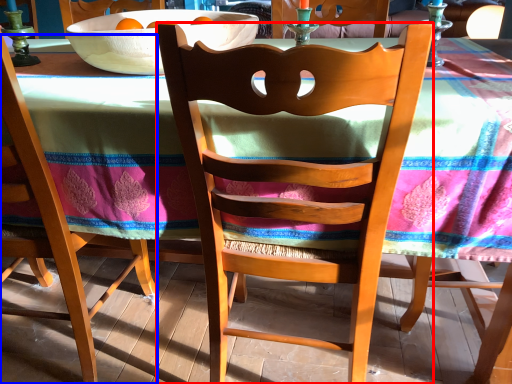
Question: Which object is closer to the camera taking this photo, chair (highlighted by a red box) or chair (highlighted by a blue box)?

Choices:
 (A) chair
 (B) chair

Answer: (A)